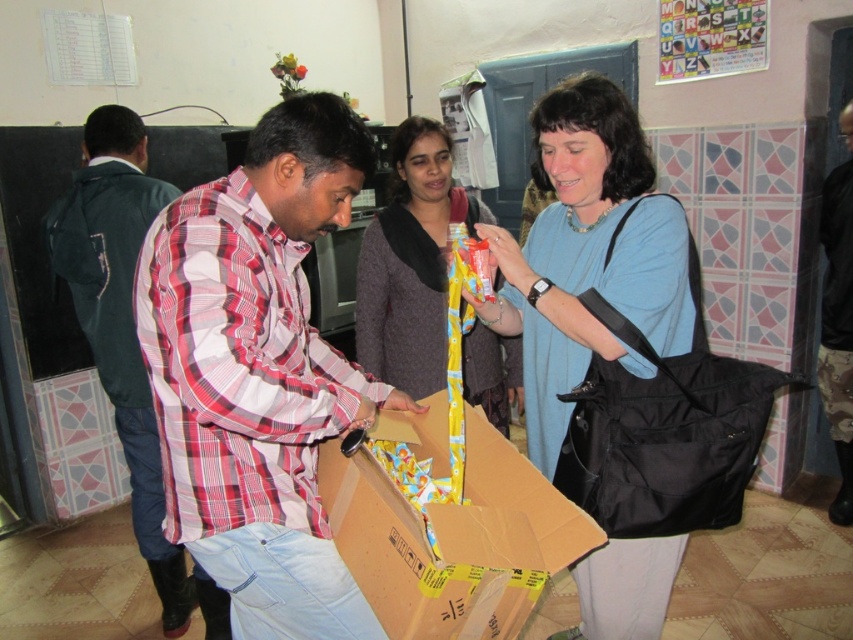
Can you confirm if plaid shirt at center is smaller than blue fabric dress at center?

Actually, plaid shirt at center might be larger than blue fabric dress at center.

Between point (173, 317) and point (494, 246), which one is positioned behind?

Point (494, 246)

Identify the location of plaid shirt at center. The image size is (853, 640). (258, 372).

Is blue fabric dress at center further to the viewer compared to matte yellow scarf at center?

No, blue fabric dress at center is in front of matte yellow scarf at center.

Which is behind, point (534, 284) or point (497, 337)?

Point (497, 337)

Locate an element on the screen. The height and width of the screenshot is (640, 853). blue fabric dress at center is located at coordinates (587, 257).

Can you confirm if plaid shirt at center is positioned above plaid shirt at left?

Incorrect, plaid shirt at center is not positioned above plaid shirt at left.

Does plaid shirt at center come in front of plaid shirt at left?

Yes, plaid shirt at center is in front of plaid shirt at left.

The width and height of the screenshot is (853, 640). Describe the element at coordinates (258, 372) in the screenshot. I see `plaid shirt at center` at that location.

What are the coordinates of `plaid shirt at center` in the screenshot? It's located at (258, 372).